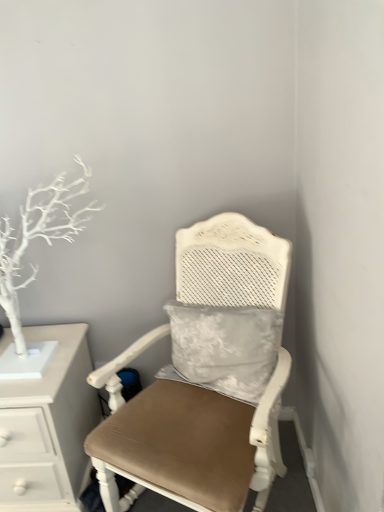
Question: From the image's perspective, is white matte tree at left above or below matte white chair at center?

Choices:
 (A) below
 (B) above

Answer: (B)

Question: Looking at their shapes, would you say white matte tree at left is wider or thinner than matte white chair at center?

Choices:
 (A) wide
 (B) thin

Answer: (B)

Question: Which object is positioned farthest from the matte white chair at center?

Choices:
 (A) white painted wood chest of drawers at left
 (B) white matte tree at left

Answer: (B)

Question: Considering the real-world distances, which object is farthest from the white painted wood chest of drawers at left?

Choices:
 (A) white matte tree at left
 (B) matte white chair at center

Answer: (B)